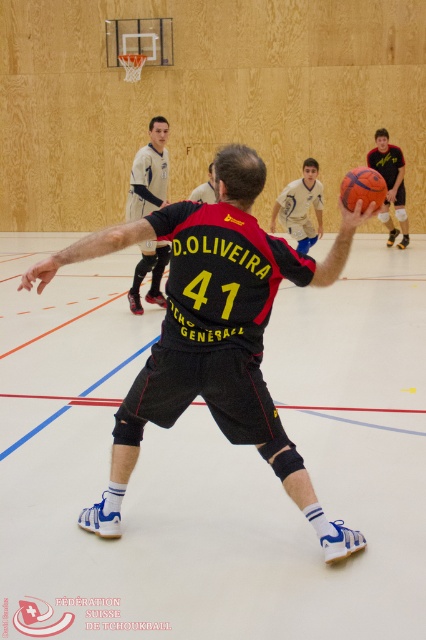
Question: Which point is closer to the camera?

Choices:
 (A) black matte jersey at center
 (B) blue jersey at center

Answer: (A)

Question: Can you confirm if blue jersey at center is positioned to the left of glossy orange basketball at center?

Choices:
 (A) yes
 (B) no

Answer: (B)

Question: Is black matte jersey at center below blue jersey at center?

Choices:
 (A) yes
 (B) no

Answer: (A)

Question: From the image, what is the correct spatial relationship of light blue jersey at center in relation to glossy orange basketball at center?

Choices:
 (A) below
 (B) above

Answer: (B)

Question: Which of the following is the closest to the observer?

Choices:
 (A) blue jersey at center
 (B) black matte jersey at center

Answer: (B)

Question: Which point is closer to the camera?

Choices:
 (A) blue jersey at center
 (B) light blue jersey at center

Answer: (B)